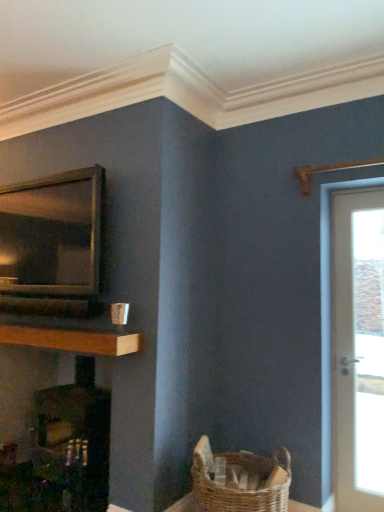
Question: Is white glossy door at right smaller than metallic silver microwave at left?

Choices:
 (A) yes
 (B) no

Answer: (A)

Question: Does white glossy door at right have a lesser width compared to metallic silver microwave at left?

Choices:
 (A) yes
 (B) no

Answer: (A)

Question: From the image's perspective, is white glossy door at right beneath metallic silver microwave at left?

Choices:
 (A) yes
 (B) no

Answer: (A)

Question: From the image's perspective, is white glossy door at right on top of metallic silver microwave at left?

Choices:
 (A) no
 (B) yes

Answer: (A)

Question: Is white glossy door at right surrounding metallic silver microwave at left?

Choices:
 (A) no
 (B) yes

Answer: (A)

Question: Is the depth of white glossy door at right greater than that of metallic silver microwave at left?

Choices:
 (A) no
 (B) yes

Answer: (B)

Question: Is matte black fireplace at left thinner than wooden at left?

Choices:
 (A) yes
 (B) no

Answer: (B)

Question: From the image's perspective, is matte black fireplace at left over wooden at left?

Choices:
 (A) no
 (B) yes

Answer: (A)

Question: From a real-world perspective, is matte black fireplace at left located higher than wooden at left?

Choices:
 (A) no
 (B) yes

Answer: (A)

Question: Does matte black fireplace at left appear on the right side of wooden at left?

Choices:
 (A) no
 (B) yes

Answer: (B)

Question: Does matte black fireplace at left appear on the left side of wooden at left?

Choices:
 (A) yes
 (B) no

Answer: (B)

Question: Is matte black fireplace at left facing away from wooden at left?

Choices:
 (A) no
 (B) yes

Answer: (A)

Question: Can you confirm if wooden at left is positioned to the left of matte black fireplace at left?

Choices:
 (A) no
 (B) yes

Answer: (B)